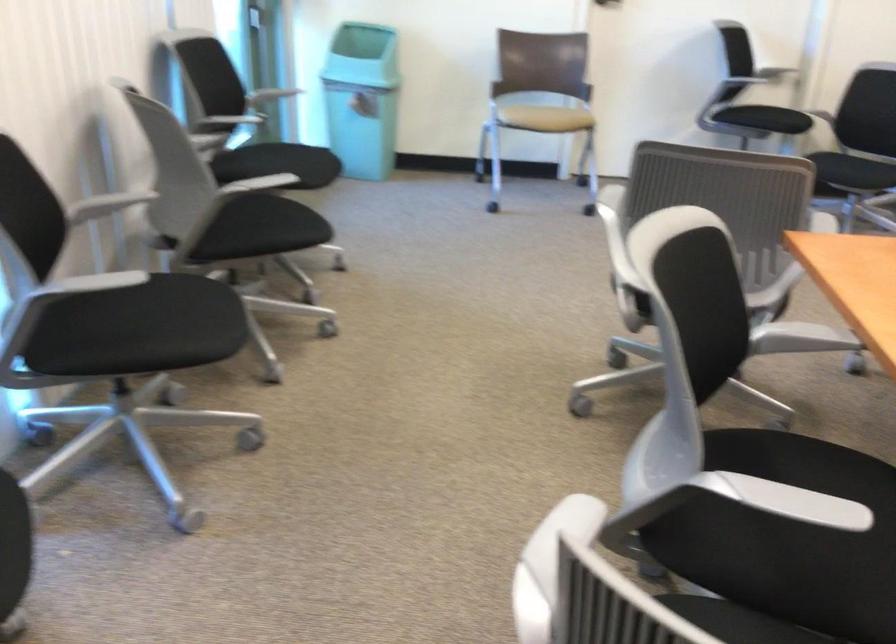
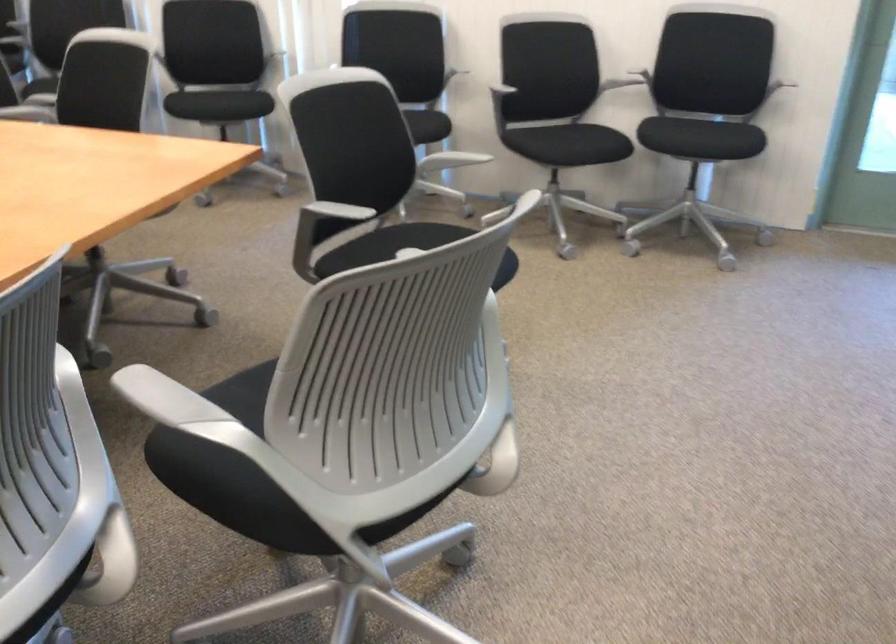
Find the pixel in the second image that matches point 769,242 in the first image.

(332, 212)